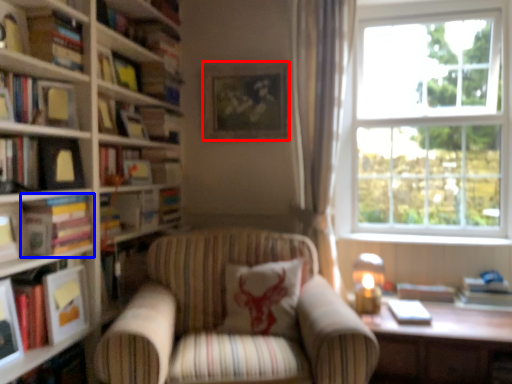
Question: Which of the following is the closest to the observer, picture frame (highlighted by a red box) or book (highlighted by a blue box)?

Choices:
 (A) picture frame
 (B) book

Answer: (B)